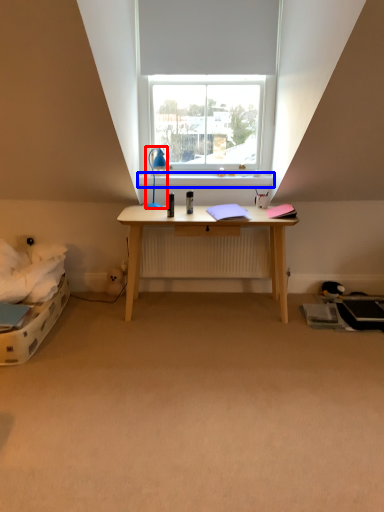
Question: Which object appears farthest to the camera in this image, lamp (highlighted by a red box) or window sill (highlighted by a blue box)?

Choices:
 (A) lamp
 (B) window sill

Answer: (B)